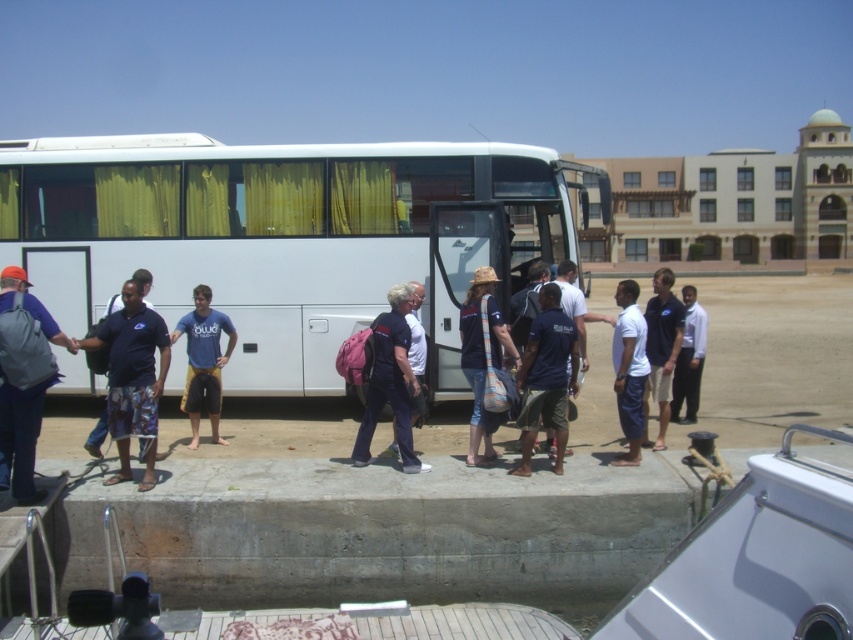
Question: Which point is farther to the camera?

Choices:
 (A) white matte bus at center
 (B) white cotton shirt at center

Answer: (A)

Question: Considering the real-world distances, which object is farthest from the white shirt at center?

Choices:
 (A) dark blue uniform at center
 (B) blue printed shirt at left
 (C) dark blue fabric shirt at center

Answer: (B)

Question: Does blue cotton shirt at center appear over white cotton shirt at center?

Choices:
 (A) yes
 (B) no

Answer: (B)

Question: Among these points, which one is farthest from the camera?

Choices:
 (A) (123, 314)
 (B) (694, 387)
 (C) (572, 326)
 (D) (479, 465)

Answer: (B)

Question: Can you confirm if white matte bus at center is smaller than white cotton shirt at center?

Choices:
 (A) no
 (B) yes

Answer: (A)

Question: Is matte blue shirt at center wider than blue fabric shirt at center?

Choices:
 (A) yes
 (B) no

Answer: (B)